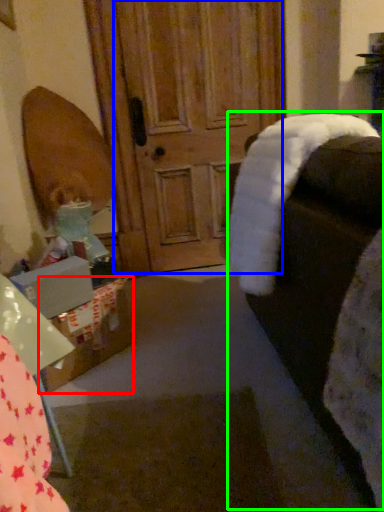
Question: Which object is the closest to the cardboard box (highlighted by a red box)? Choose among these: screen door (highlighted by a blue box) or rocking chair (highlighted by a green box).

Choices:
 (A) screen door
 (B) rocking chair

Answer: (B)